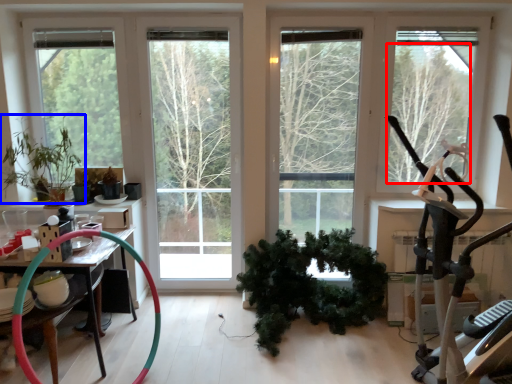
Question: Which object is further to the camera taking this photo, tree (highlighted by a red box) or houseplant (highlighted by a blue box)?

Choices:
 (A) tree
 (B) houseplant

Answer: (A)